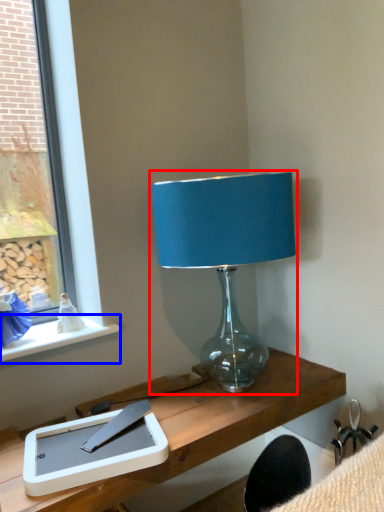
Question: Which object appears farthest to the camera in this image, lamp (highlighted by a red box) or window sill (highlighted by a blue box)?

Choices:
 (A) lamp
 (B) window sill

Answer: (B)